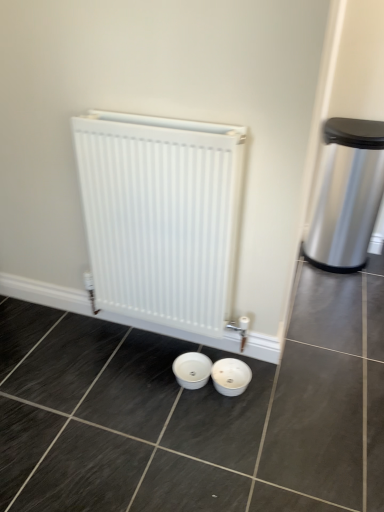
Identify the location of vacant space that is to the left of white matte radiator at center. This screenshot has width=384, height=512. (70, 358).